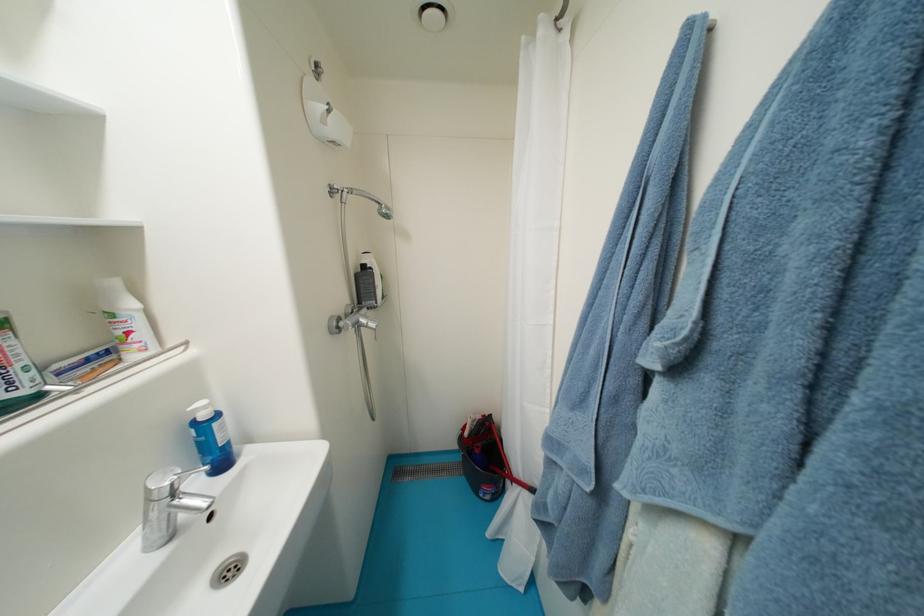
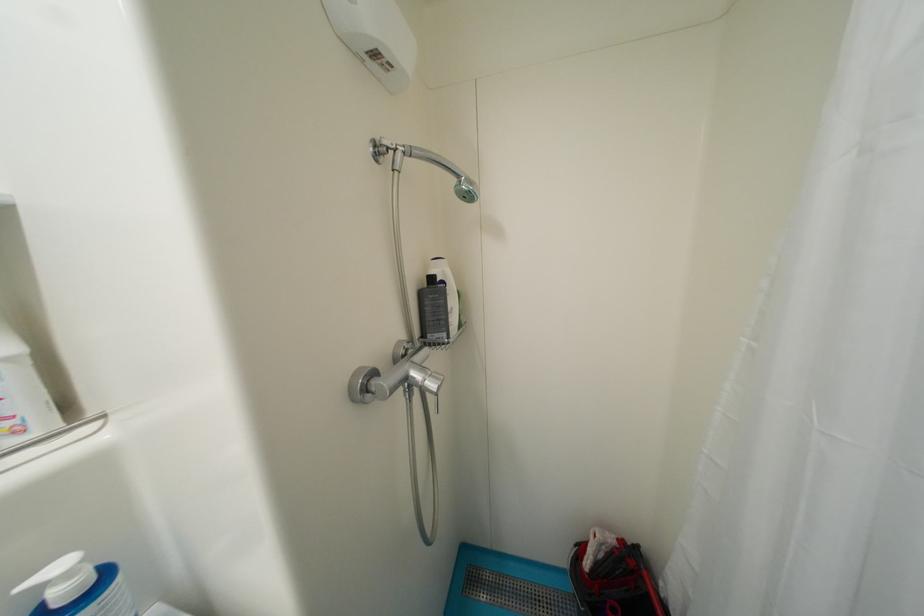
Question: Which direction would the cameraman need to move to produce the second image? Reply with the corresponding letter.

Choices:
 (A) Left
 (B) Right
 (C) Forward
 (D) Backward

Answer: (C)